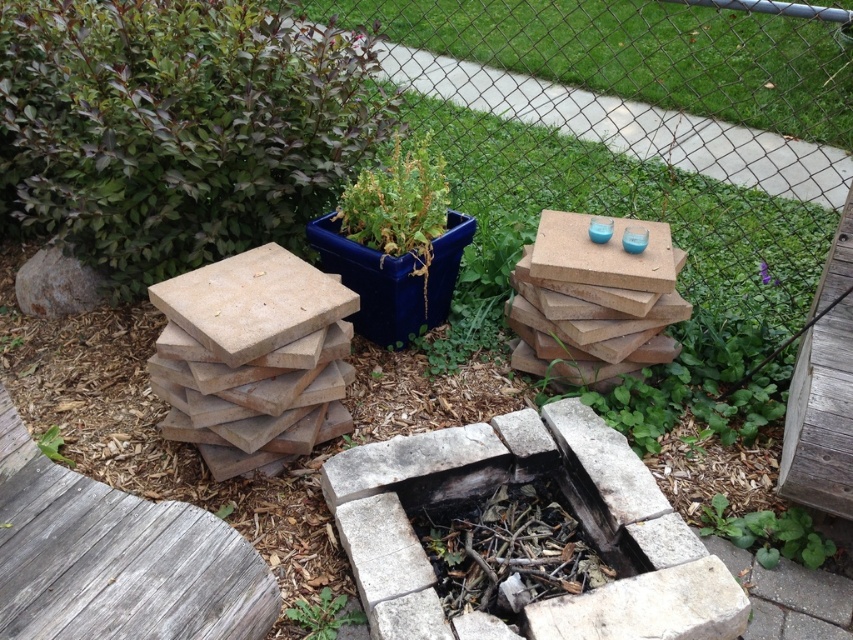
In the scene shown: You are standing in the backyard and see the green matte plant at left and the green leafy plant at lower center. Which one is positioned more to the left side of the scene?

The green matte plant at left is positioned more to the left side of the scene than the green leafy plant at lower center.

You are a gardener who needs to water two plants in the backyard. The green matte plant at left and the green leafy plant at lower center are both in need of water. If you are standing at the fire pit, which plant is closer to you?

The green leafy plant at lower center is closer to the fire pit than the green matte plant at left, so you should water it first.